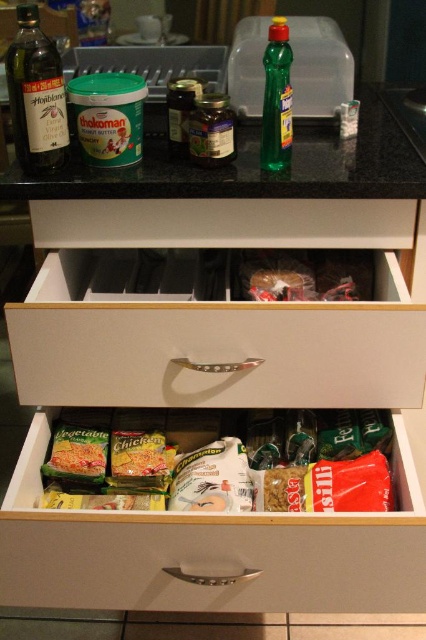
In the scene shown: You have a small toy car that is 10 cm long and want to store it in either the white matte drawer at center or the matte glass bottle at left. Based on their sizes, which one can fit the toy car better?

The white matte drawer at center has a larger width than the matte glass bottle at left, so the toy car will fit better in the white matte drawer at center.

You are organizing items on the kitchen countertop and need to place a 12 inch long spatula between the white matte drawer at center and the matte glass bottle at left. Will there be enough space?

The white matte drawer at center is 15.20 inches away from the matte glass bottle at left, so yes, the 12 inch long spatula will fit between them since the distance is greater than the spatula length.